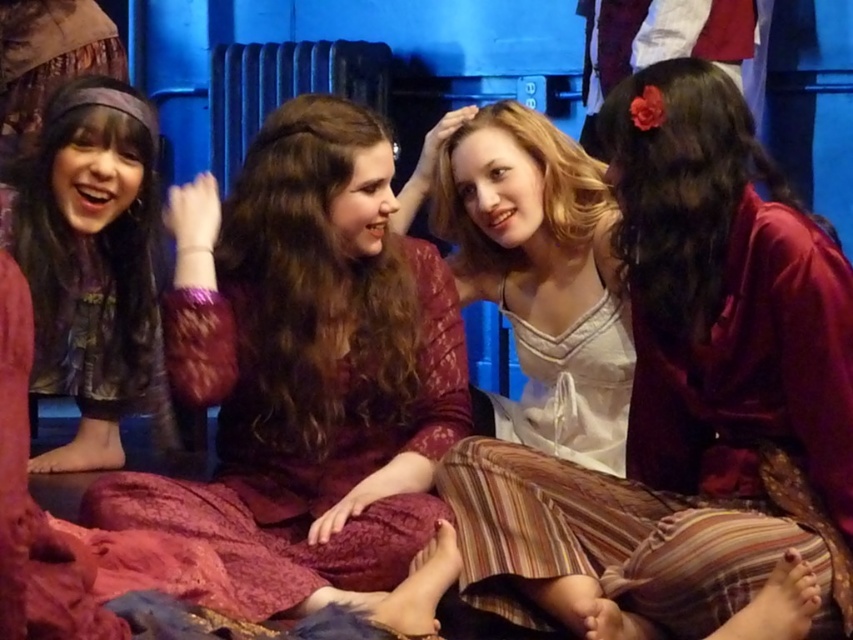
Can you confirm if matte purple dress at left is taller than metallic radiator at center?

Indeed, matte purple dress at left has a greater height compared to metallic radiator at center.

Is matte purple dress at left thinner than metallic radiator at center?

Yes.

Who is more forward, (149,164) or (248,113)?

Positioned in front is point (149,164).

You are a GUI agent. You are given a task and a screenshot of the screen. Output one action in this format:
    pyautogui.click(x=<x>, y=<y>)
    Task: Click on the matte purple dress at left
    This screenshot has width=853, height=640.
    Given the screenshot: What is the action you would take?
    pyautogui.click(x=91, y=266)

Which is behind, point (312, 396) or point (524, 332)?

The point (524, 332) is behind.

Can you confirm if matte burgundy dress at center is positioned to the left of white satin dress at center?

Yes, matte burgundy dress at center is to the left of white satin dress at center.

Is point (418, 435) in front of point (625, 403)?

Yes.

The image size is (853, 640). I want to click on matte burgundy dress at center, so click(306, 368).

Does matte white blouse at center appear over metallic radiator at center?

Incorrect, matte white blouse at center is not positioned above metallic radiator at center.

Is point (782, 497) more distant than point (231, 134)?

No.

Where is `matte white blouse at center`? The height and width of the screenshot is (640, 853). matte white blouse at center is located at coordinates (688, 396).